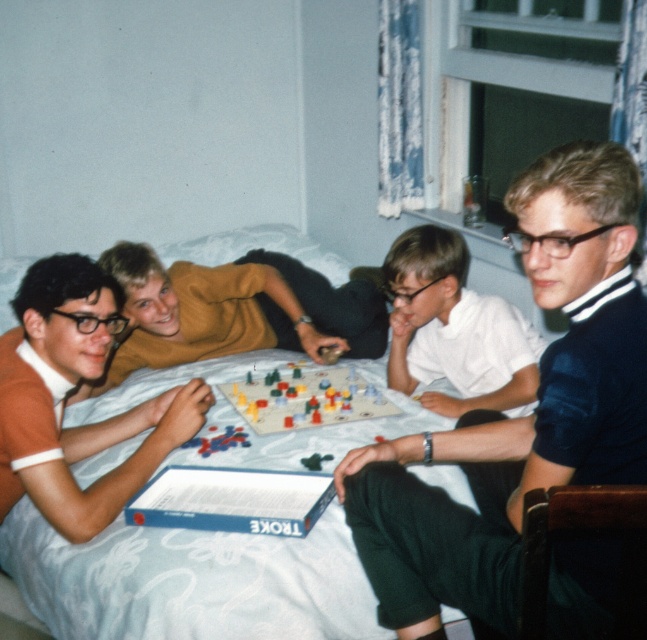
Question: Which point is farther from the camera taking this photo?

Choices:
 (A) (126, 390)
 (B) (91, 388)

Answer: (A)

Question: Considering the relative positions of dark blue jersey at center and matte orange shirt at left in the image provided, where is dark blue jersey at center located with respect to matte orange shirt at left?

Choices:
 (A) right
 (B) left

Answer: (A)

Question: Is dark blue jersey at center positioned at the back of plastic colorful game pieces at center?

Choices:
 (A) no
 (B) yes

Answer: (A)

Question: Does white fabric bed at center have a greater width compared to matte yellow shirt at center?

Choices:
 (A) yes
 (B) no

Answer: (A)

Question: Based on their relative distances, which object is nearer to the matte orange shirt at left?

Choices:
 (A) dark blue jersey at center
 (B) white fabric bed at center

Answer: (B)

Question: Estimate the real-world distances between objects in this image. Which object is closer to the white matte shirt at center?

Choices:
 (A) matte yellow shirt at center
 (B) plastic colorful game pieces at center
 (C) white fabric bed at center
 (D) matte orange shirt at left

Answer: (B)